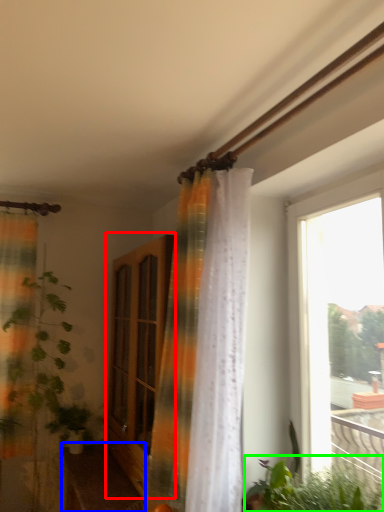
Question: Which object is positioned closest to screen door (highlighted by a red box)? Select from furniture (highlighted by a blue box) and vegetation (highlighted by a green box).

Choices:
 (A) furniture
 (B) vegetation

Answer: (A)